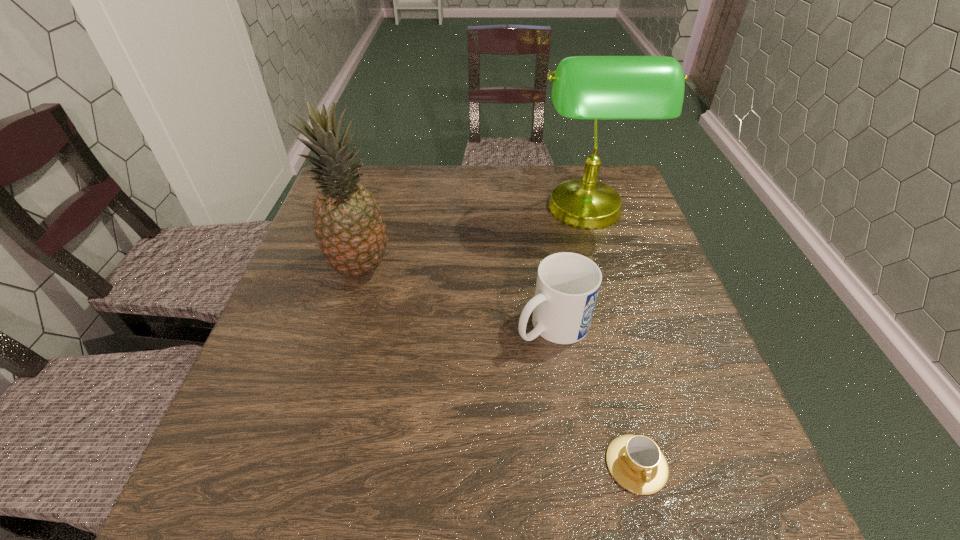
Where is `lamp`? lamp is located at coordinates (584, 87).

Image resolution: width=960 pixels, height=540 pixels. Identify the location of the second farthest object. (349, 228).

I want to click on pineapple, so click(x=349, y=228).

Find the location of a particular element. The height and width of the screenshot is (540, 960). mug is located at coordinates (567, 286).

You are a GUI agent. You are given a task and a screenshot of the screen. Output one action in this format:
    pyautogui.click(x=<x>, y=<y>)
    Task: Click on the second shortest object
    
    Given the screenshot: What is the action you would take?
    pyautogui.click(x=567, y=286)

What are the coordinates of `cup` in the screenshot? It's located at (635, 461).

The height and width of the screenshot is (540, 960). In order to click on the nearest object in this screenshot , I will do (635, 461).

Image resolution: width=960 pixels, height=540 pixels. I want to click on free point located 0.340m on the desk next to the farthest object, so click(409, 212).

Locate an element on the screen. The width and height of the screenshot is (960, 540). free space located 0.200m on the desk next to the farthest object is located at coordinates (460, 212).

You are a GUI agent. You are given a task and a screenshot of the screen. Output one action in this format:
    pyautogui.click(x=<x>, y=<y>)
    Task: Click on the vacant space located 0.240m on the desk next to the farthest object
    This screenshot has height=540, width=960.
    Given the screenshot: What is the action you would take?
    (x=445, y=212)